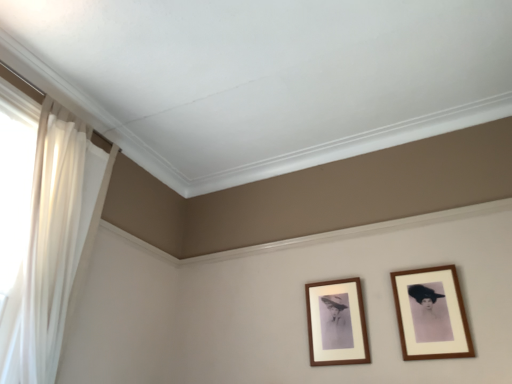
Where is `white sheer curtain at left`? white sheer curtain at left is located at coordinates (40, 228).

Describe the element at coordinates (431, 314) in the screenshot. The width and height of the screenshot is (512, 384). I see `wooden frame at right, which is the first picture frame from right to left` at that location.

I want to click on white sheer curtain at left, so click(x=40, y=228).

How many degrees apart are the facing directions of wooden frame at center, the second picture frame when ordered from right to left, and wooden frame at right, which is counted as the second picture frame, starting from the left?

There is a 0.000106-degree angle between the facing directions of wooden frame at center, the second picture frame when ordered from right to left, and wooden frame at right, which is counted as the second picture frame, starting from the left.

From the image's perspective, is wooden frame at center, the second picture frame when ordered from right to left, located above or below wooden frame at right, which is counted as the second picture frame, starting from the left?

wooden frame at center, the second picture frame when ordered from right to left, is below wooden frame at right, which is counted as the second picture frame, starting from the left.

Considering the sizes of objects wooden frame at center, the second picture frame when ordered from right to left, and wooden frame at right, which is the first picture frame from right to left, in the image provided, who is shorter, wooden frame at center, the second picture frame when ordered from right to left, or wooden frame at right, which is the first picture frame from right to left,?

Result: Standing shorter between the two is wooden frame at right, which is the first picture frame from right to left.

Which is more to the left, wooden frame at center, the second picture frame when ordered from right to left, or wooden frame at right, which is the first picture frame from right to left?

Positioned to the left is wooden frame at center, the second picture frame when ordered from right to left.

Looking at this image, would you say wooden frame at right, which is counted as the second picture frame, starting from the left, is to the left or to the right of white sheer curtain at left in the picture?

Based on their positions, wooden frame at right, which is counted as the second picture frame, starting from the left, is located to the right of white sheer curtain at left.

Where is `curtain in front of the wooden frame at right, which is counted as the second picture frame, starting from the left`? This screenshot has width=512, height=384. curtain in front of the wooden frame at right, which is counted as the second picture frame, starting from the left is located at coordinates (40, 228).

Is white sheer curtain at left completely or partially inside wooden frame at right, which is the first picture frame from right to left?

Actually, white sheer curtain at left is outside wooden frame at right, which is the first picture frame from right to left.

Measure the distance between wooden frame at right, which is the first picture frame from right to left, and white sheer curtain at left.

wooden frame at right, which is the first picture frame from right to left, and white sheer curtain at left are 1.88 meters apart.

Find the location of a particular element. This screenshot has width=512, height=384. curtain located on the left of wooden frame at center, the second picture frame when ordered from right to left is located at coordinates (40, 228).

From the picture: Is white sheer curtain at left taller or shorter than wooden frame at center, the second picture frame when ordered from right to left?

white sheer curtain at left is taller than wooden frame at center, the second picture frame when ordered from right to left.

Is white sheer curtain at left positioned beyond the bounds of wooden frame at center, arranged as the 1th picture frame when viewed from the left?

Yes, white sheer curtain at left is not within wooden frame at center, arranged as the 1th picture frame when viewed from the left.

Is wooden frame at right, which is the first picture frame from right to left, facing towards wooden frame at center, arranged as the 1th picture frame when viewed from the left?

No, wooden frame at right, which is the first picture frame from right to left, is not facing towards wooden frame at center, arranged as the 1th picture frame when viewed from the left.

Does wooden frame at right, which is the first picture frame from right to left, have a smaller size compared to wooden frame at center, arranged as the 1th picture frame when viewed from the left?

No, wooden frame at right, which is the first picture frame from right to left, is not smaller than wooden frame at center, arranged as the 1th picture frame when viewed from the left.

Is wooden frame at right, which is the first picture frame from right to left, taller than wooden frame at center, arranged as the 1th picture frame when viewed from the left?

No.

Can you confirm if white sheer curtain at left is wider than wooden frame at right, which is counted as the second picture frame, starting from the left?

Yes, white sheer curtain at left is wider than wooden frame at right, which is counted as the second picture frame, starting from the left.

Is white sheer curtain at left to the left of wooden frame at right, which is counted as the second picture frame, starting from the left, from the viewer's perspective?

Yes, white sheer curtain at left is to the left of wooden frame at right, which is counted as the second picture frame, starting from the left.

Considering the positions of points (26, 323) and (429, 326), is point (26, 323) closer to camera compared to point (429, 326)?

That is True.

From the image's perspective, is white sheer curtain at left located above or below wooden frame at right, which is the first picture frame from right to left?

Based on their image positions, white sheer curtain at left is located above wooden frame at right, which is the first picture frame from right to left.

Looking at this image, which of these two, wooden frame at center, arranged as the 1th picture frame when viewed from the left, or white sheer curtain at left, is smaller?

wooden frame at center, arranged as the 1th picture frame when viewed from the left, is smaller.

Looking at this image, is wooden frame at center, arranged as the 1th picture frame when viewed from the left, inside the boundaries of white sheer curtain at left, or outside?

wooden frame at center, arranged as the 1th picture frame when viewed from the left, exists outside the volume of white sheer curtain at left.

Which object is positioned more to the left, wooden frame at center, the second picture frame when ordered from right to left, or white sheer curtain at left?

white sheer curtain at left is more to the left.

Is the position of wooden frame at center, arranged as the 1th picture frame when viewed from the left, more distant than that of white sheer curtain at left?

Yes, wooden frame at center, arranged as the 1th picture frame when viewed from the left, is further from the camera.

In the image, there is a wooden frame at center, the second picture frame when ordered from right to left. Identify the location of picture frame above it (from the image's perspective). The height and width of the screenshot is (384, 512). (x=431, y=314).

Identify the location of curtain on the left of the wooden frame at right, which is counted as the second picture frame, starting from the left. (40, 228).

Based on their spatial positions, is white sheer curtain at left or wooden frame at center, the second picture frame when ordered from right to left, further from wooden frame at right, which is counted as the second picture frame, starting from the left?

white sheer curtain at left is further to wooden frame at right, which is counted as the second picture frame, starting from the left.

From the image, which object appears to be farther from white sheer curtain at left, wooden frame at center, arranged as the 1th picture frame when viewed from the left, or wooden frame at right, which is the first picture frame from right to left?

wooden frame at right, which is the first picture frame from right to left.

Looking at the image, which one is located closer to wooden frame at right, which is counted as the second picture frame, starting from the left, wooden frame at center, arranged as the 1th picture frame when viewed from the left, or white sheer curtain at left?

wooden frame at center, arranged as the 1th picture frame when viewed from the left, is closer to wooden frame at right, which is counted as the second picture frame, starting from the left.

When comparing their distances from white sheer curtain at left, does wooden frame at right, which is the first picture frame from right to left, or wooden frame at center, arranged as the 1th picture frame when viewed from the left, seem further?

wooden frame at right, which is the first picture frame from right to left, lies further to white sheer curtain at left than the other object.

Estimate the real-world distances between objects in this image. Which object is further from wooden frame at center, arranged as the 1th picture frame when viewed from the left, white sheer curtain at left or wooden frame at right, which is the first picture frame from right to left?

white sheer curtain at left is positioned further to the anchor wooden frame at center, arranged as the 1th picture frame when viewed from the left.

From the image, which object appears to be farther from wooden frame at center, arranged as the 1th picture frame when viewed from the left, wooden frame at right, which is the first picture frame from right to left, or white sheer curtain at left?

white sheer curtain at left.

This screenshot has height=384, width=512. In order to click on picture frame between white sheer curtain at left and wooden frame at right, which is counted as the second picture frame, starting from the left in this screenshot , I will do `click(336, 323)`.